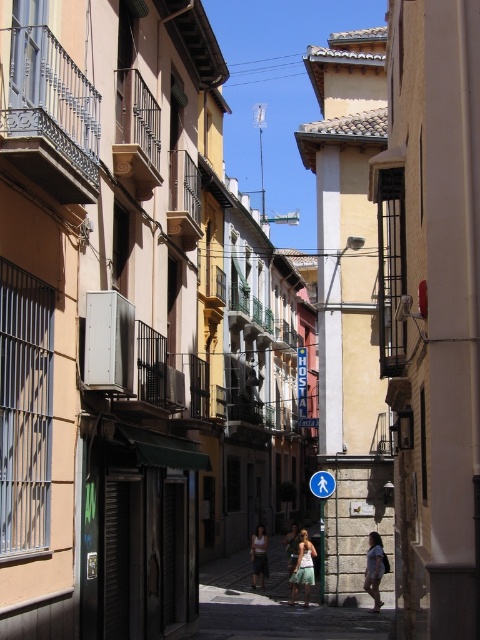
You are a tourist standing on the street and see both the light blue fabric dress at center and the blue plastic pedestrian sign at center. Which one is closer to you?

Answer: The light blue fabric dress at center is closer to you since it is in front of the blue plastic pedestrian sign at center.

You are a delivery person with a 1.2 meter wide cart. You need to navigate through the narrow street while avoiding obstacles. There is a light blue fabric dress at center and a blue plastic pedestrian sign at center in your path. Can your cart pass between them without touching either?

The light blue fabric dress at center might be wider than blue plastic pedestrian sign at center, so there is uncertainty about the available space. The cart should proceed cautiously or find an alternative route to avoid potential collision.